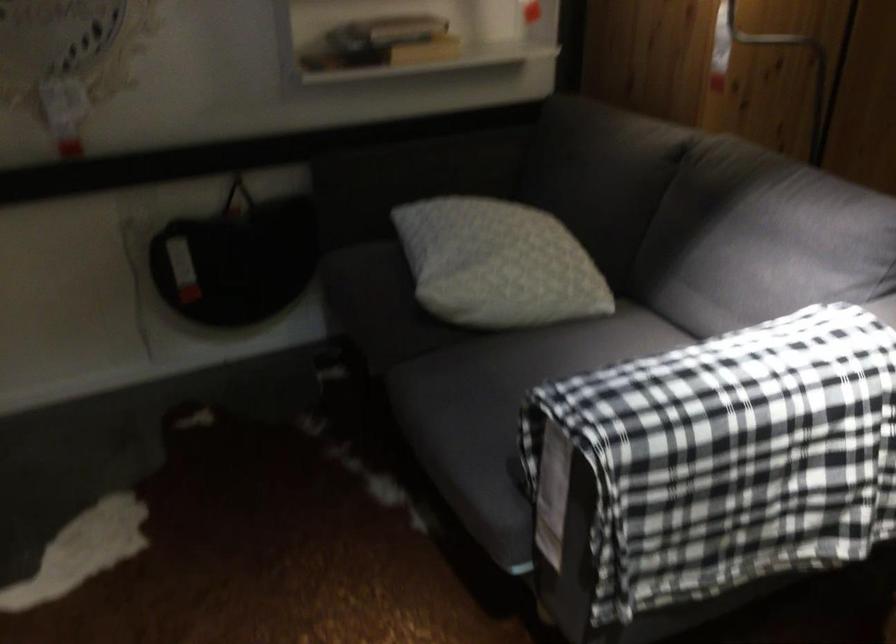
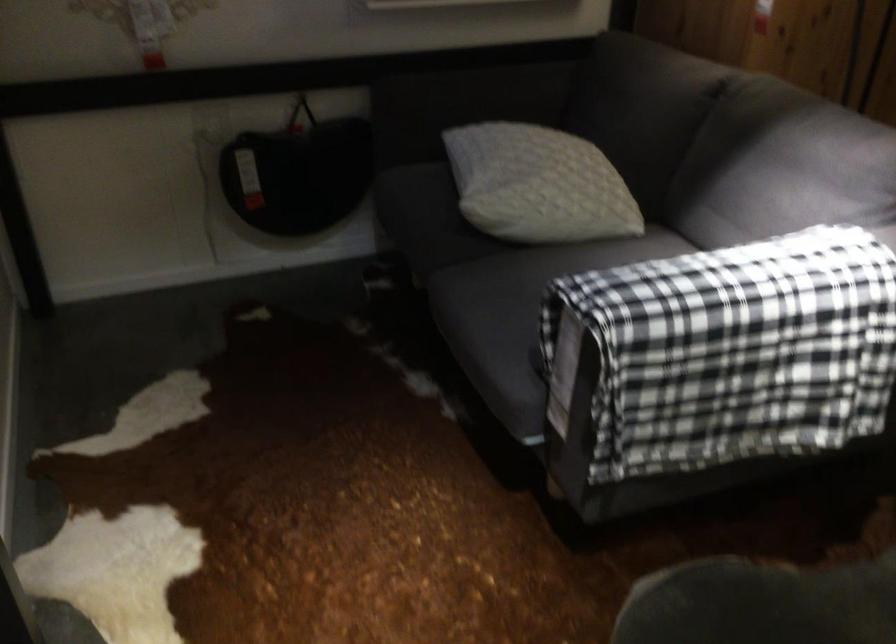
In the second image, find the point that corresponds to [429,175] in the first image.

(478, 98)